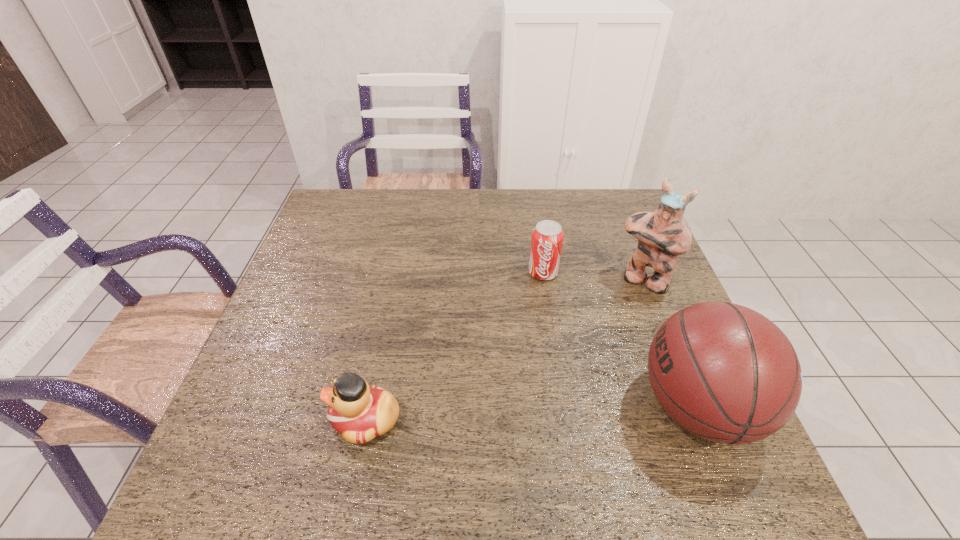
Locate an element on the screen. This screenshot has height=540, width=960. free space between the tallest object and the duck is located at coordinates (504, 349).

You are a GUI agent. You are given a task and a screenshot of the screen. Output one action in this format:
    pyautogui.click(x=<x>, y=<y>)
    Task: Click on the vacant area that lies between the third object from right to left and the duck
    The width and height of the screenshot is (960, 540).
    Given the screenshot: What is the action you would take?
    pyautogui.click(x=454, y=346)

At what (x,y) coordinates should I click in order to perform the action: click on vacant area that lies between the figurine and the second object from left to right. Please return your answer as a coordinate pair (x, y). Looking at the image, I should click on (593, 276).

The height and width of the screenshot is (540, 960). In order to click on the closest object relative to the second tallest object in this screenshot , I will do `click(662, 235)`.

Point out which object is positioned as the nearest to the second object from left to right. Please provide its 2D coordinates. Your answer should be formatted as a tuple, i.e. [(x, y)], where the tuple contains the x and y coordinates of a point satisfying the conditions above.

[(662, 235)]